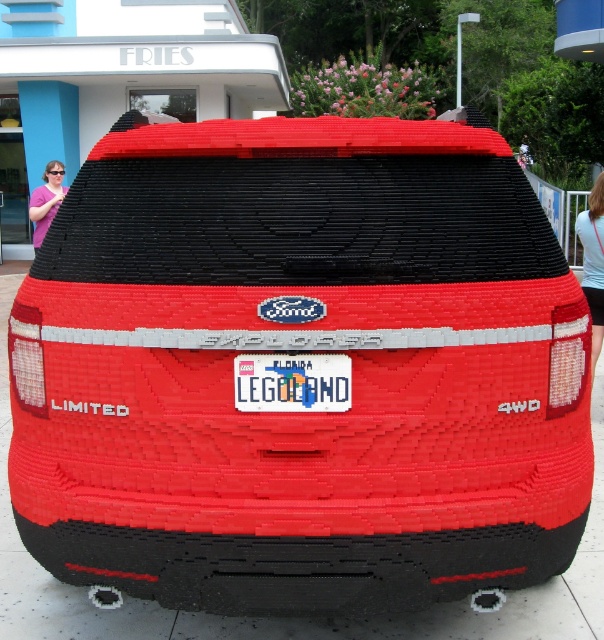
Locate an element on the screen. white plastic license plate at center is located at coordinates [x=292, y=381].

Is white plastic license plate at center thinner than pink fabric sunglasses at left?

No.

Locate an element on the screen. white plastic license plate at center is located at coordinates (292, 381).

Based on the photo, who is more forward, (x=295, y=387) or (x=591, y=275)?

Point (x=295, y=387)

Where is `white plastic license plate at center`? The image size is (604, 640). white plastic license plate at center is located at coordinates (292, 381).

I want to click on white plastic license plate at center, so click(x=292, y=381).

Between point (586, 248) and point (50, 161), which one is positioned in front?

Positioned in front is point (586, 248).

Is blue denim shorts at lower right thinner than pink fabric sunglasses at left?

Correct, blue denim shorts at lower right's width is less than pink fabric sunglasses at left's.

Find the location of a particular element. The width and height of the screenshot is (604, 640). blue denim shorts at lower right is located at coordinates (593, 262).

Locate an element on the screen. blue denim shorts at lower right is located at coordinates (593, 262).